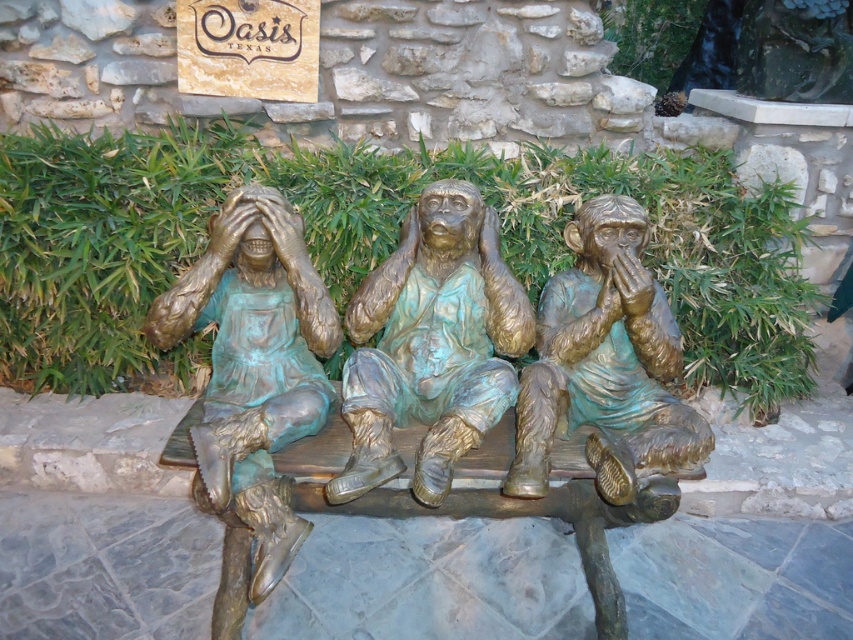
Is point (280, 564) in front of point (518, 486)?

Yes.

Who is more distant from viewer, (273, 349) or (569, 289)?

Positioned behind is point (569, 289).

Where is `bronze statue at left`? bronze statue at left is located at coordinates (254, 364).

Does bronze statue at center appear on the right side of bronze statue at left?

Correct, you'll find bronze statue at center to the right of bronze statue at left.

Can you confirm if bronze statue at center is smaller than bronze statue at left?

Yes, bronze statue at center is smaller than bronze statue at left.

What do you see at coordinates (431, 344) in the screenshot?
I see `bronze statue at center` at bounding box center [431, 344].

The image size is (853, 640). What are the coordinates of `bronze statue at center` in the screenshot? It's located at (431, 344).

The height and width of the screenshot is (640, 853). I want to click on bronze statue at center, so click(x=431, y=344).

Does bronze statue at center appear over green patina bronze monkey at center?

Yes, bronze statue at center is above green patina bronze monkey at center.

Between point (416, 237) and point (672, 440), which one is positioned in front?

Point (672, 440)

Locate an element on the screen. Image resolution: width=853 pixels, height=640 pixels. bronze statue at center is located at coordinates pos(431,344).